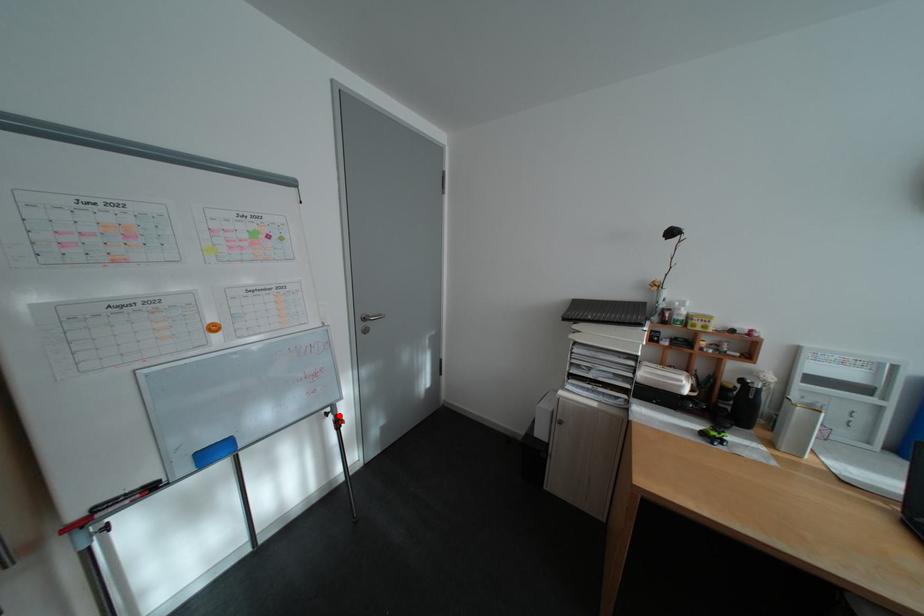
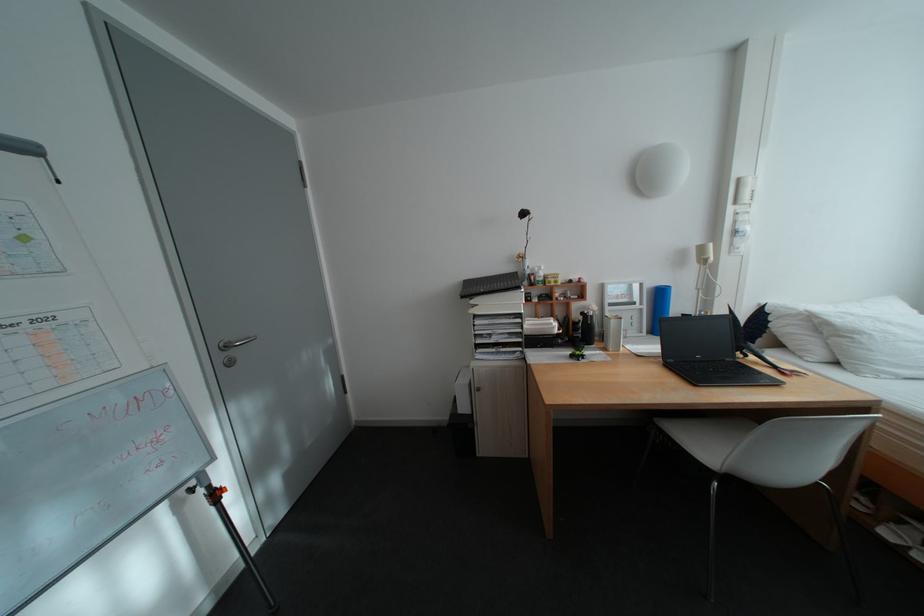
Question: I am providing you with two images of the same scene from different viewpoints. Image1 has a red point marked. In image2, the corresponding 3D location appears at what relative position? Reply with the corresponding letter.

Choices:
 (A) Closer
 (B) Farther

Answer: (B)